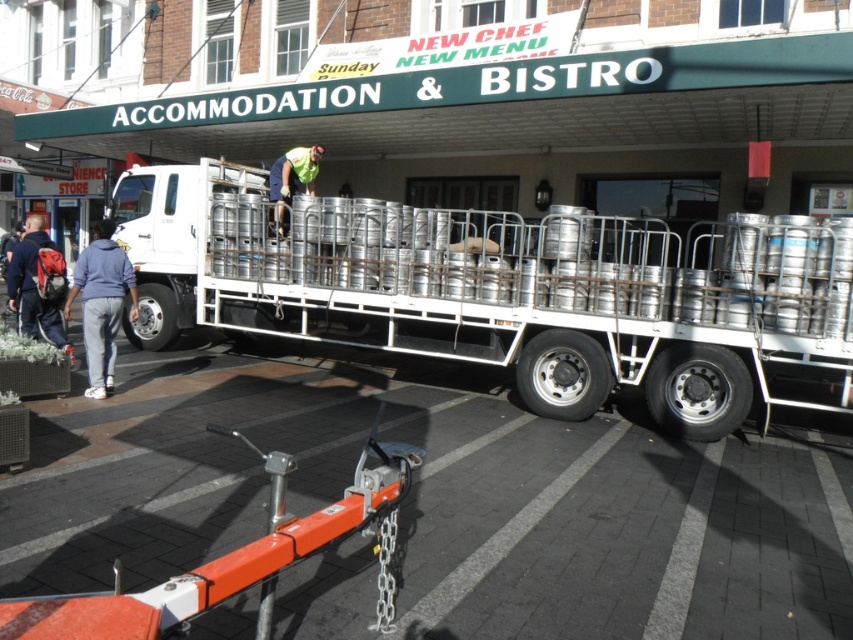
Which of these two, metallic silver kegs at center or denim jacket at left, stands shorter?

denim jacket at left

Does metallic silver kegs at center have a larger size compared to denim jacket at left?

Correct, metallic silver kegs at center is larger in size than denim jacket at left.

Locate an element on the screen. This screenshot has height=640, width=853. metallic silver kegs at center is located at coordinates (503, 291).

Where is `metallic silver kegs at center`? Image resolution: width=853 pixels, height=640 pixels. metallic silver kegs at center is located at coordinates pyautogui.click(x=503, y=291).

Is denim jacket at left below green reflective vest at center?

Correct, denim jacket at left is located below green reflective vest at center.

Does denim jacket at left lie behind green reflective vest at center?

No, denim jacket at left is in front of green reflective vest at center.

Between point (44, 244) and point (288, 166), which one is positioned behind?

The point (288, 166) is behind.

Locate an element on the screen. denim jacket at left is located at coordinates (38, 284).

You are a GUI agent. You are given a task and a screenshot of the screen. Output one action in this format:
    pyautogui.click(x=<x>, y=<y>)
    Task: Click on the metallic silver kegs at center
    Image resolution: width=853 pixels, height=640 pixels.
    Given the screenshot: What is the action you would take?
    pyautogui.click(x=503, y=291)

Between metallic silver kegs at center and blue fleece jacket at lower left, which one has less height?

Standing shorter between the two is blue fleece jacket at lower left.

Which is behind, point (612, 376) or point (132, 289)?

Point (132, 289)

I want to click on metallic silver kegs at center, so click(x=503, y=291).